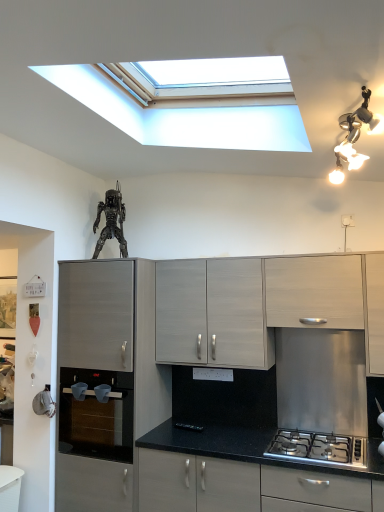
Question: Is matte gray cabinet at left, arranged as the 4th cabinetry when viewed from the right, far from black glass oven at lower left?

Choices:
 (A) yes
 (B) no

Answer: (B)

Question: From a real-world perspective, is matte gray cabinet at left, positioned as the 1th cabinetry in left-to-right order, on black glass oven at lower left?

Choices:
 (A) yes
 (B) no

Answer: (A)

Question: Is matte gray cabinet at left, arranged as the 4th cabinetry when viewed from the right, turned away from black glass oven at lower left?

Choices:
 (A) no
 (B) yes

Answer: (B)

Question: Is matte gray cabinet at left, positioned as the 1th cabinetry in left-to-right order, next to black glass oven at lower left and touching it?

Choices:
 (A) no
 (B) yes

Answer: (A)

Question: From the image's perspective, is matte gray cabinet at left, arranged as the 4th cabinetry when viewed from the right, above black glass oven at lower left?

Choices:
 (A) no
 (B) yes

Answer: (B)

Question: Considering the positions of point (206, 316) and point (127, 378), is point (206, 316) closer or farther from the camera than point (127, 378)?

Choices:
 (A) closer
 (B) farther

Answer: (B)

Question: From a real-world perspective, relative to black glass oven at lower left, is matte gray cabinet at center, which appears as the third cabinetry when viewed from the right, vertically above or below?

Choices:
 (A) below
 (B) above

Answer: (B)

Question: Is matte gray cabinet at center, the 2th cabinetry viewed from the left, taller or shorter than black glass oven at lower left?

Choices:
 (A) tall
 (B) short

Answer: (A)

Question: Visually, is matte gray cabinet at center, which appears as the third cabinetry when viewed from the right, positioned to the left or to the right of black glass oven at lower left?

Choices:
 (A) left
 (B) right

Answer: (B)

Question: Does point (354, 162) appear closer or farther from the camera than point (89, 417)?

Choices:
 (A) farther
 (B) closer

Answer: (B)

Question: In terms of height, does silver metallic light fixture at upper right look taller or shorter compared to black glass oven at lower left?

Choices:
 (A) short
 (B) tall

Answer: (A)

Question: Considering the positions of silver metallic light fixture at upper right and black glass oven at lower left in the image, is silver metallic light fixture at upper right bigger or smaller than black glass oven at lower left?

Choices:
 (A) big
 (B) small

Answer: (B)

Question: Is silver metallic light fixture at upper right spatially inside black glass oven at lower left, or outside of it?

Choices:
 (A) inside
 (B) outside

Answer: (B)

Question: Is matte gray cabinet at center, the 2th cabinetry viewed from the left, in front of or behind metallic silver figure at upper center in the image?

Choices:
 (A) behind
 (B) front

Answer: (B)

Question: Is matte gray cabinet at center, the 2th cabinetry viewed from the left, inside or outside of metallic silver figure at upper center?

Choices:
 (A) inside
 (B) outside

Answer: (B)